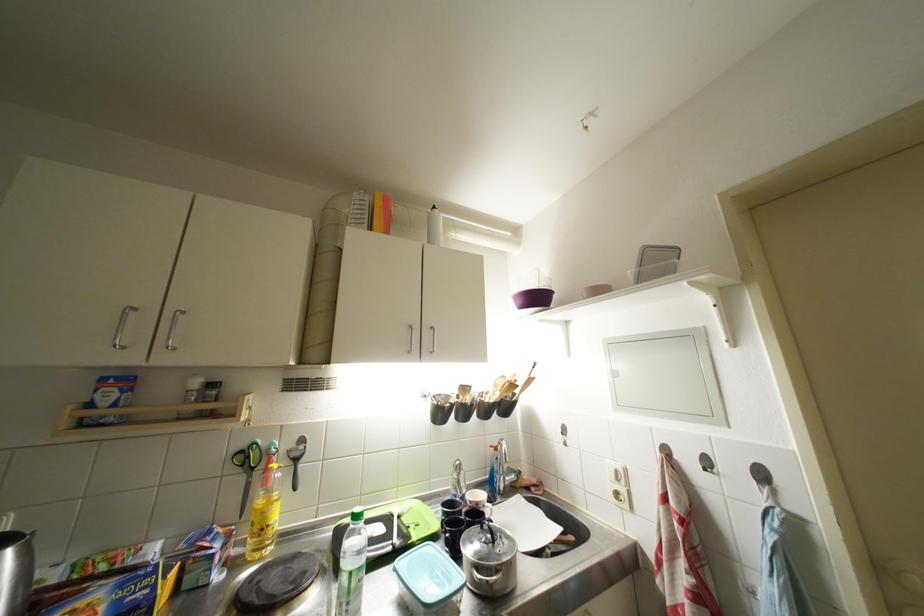
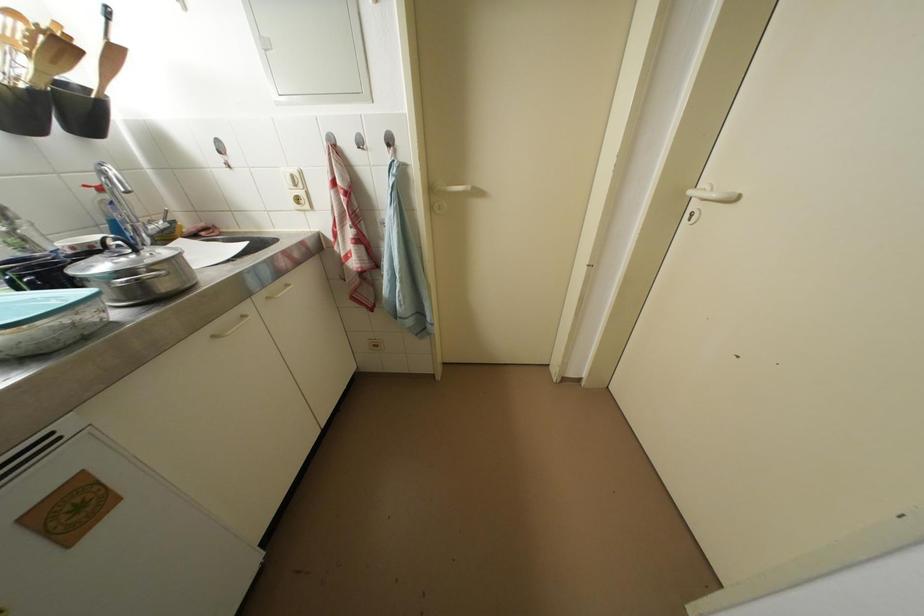
In the second image, find the point that corresponds to [519,390] in the first image.

(69, 50)